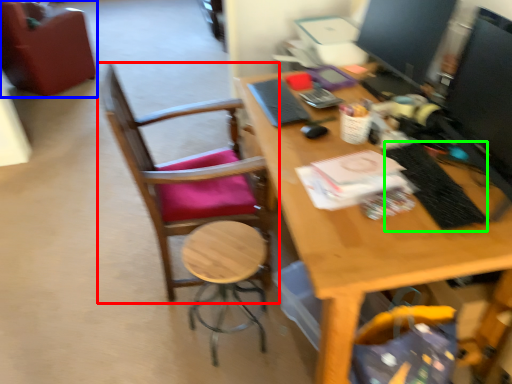
Question: Which is nearer to the chair (highlighted by a red box)? chair (highlighted by a blue box) or laptop keyboard (highlighted by a green box).

Choices:
 (A) chair
 (B) laptop keyboard

Answer: (B)